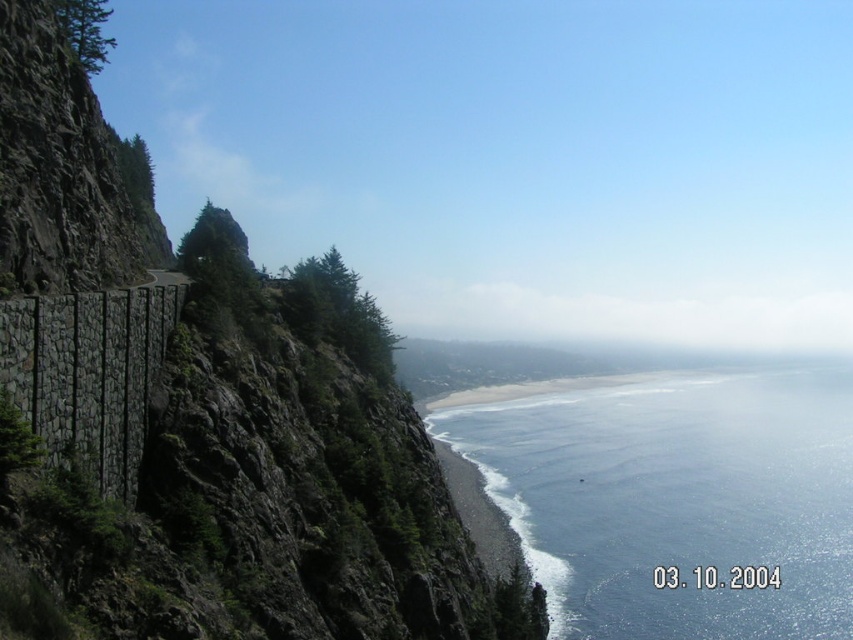
Question: Does rocky cliff at left come behind blue liquid water at lower center?

Choices:
 (A) no
 (B) yes

Answer: (A)

Question: Which object is farther from the camera taking this photo?

Choices:
 (A) blue liquid water at lower center
 (B) rocky cliff at left

Answer: (A)

Question: Can you confirm if rocky cliff at left is positioned to the right of blue liquid water at lower center?

Choices:
 (A) no
 (B) yes

Answer: (A)

Question: Among these objects, which one is farthest from the camera?

Choices:
 (A) rocky cliff at left
 (B) blue liquid water at lower center

Answer: (B)

Question: Where is rocky cliff at left located in relation to blue liquid water at lower center in the image?

Choices:
 (A) above
 (B) below

Answer: (A)